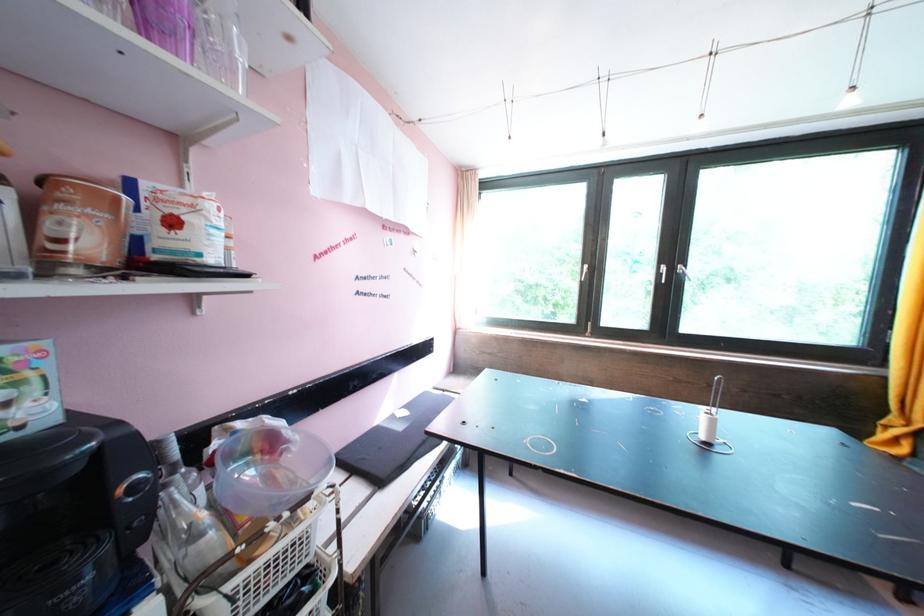
Which object does [166,25] point to?

It refers to a purple plastic cup.